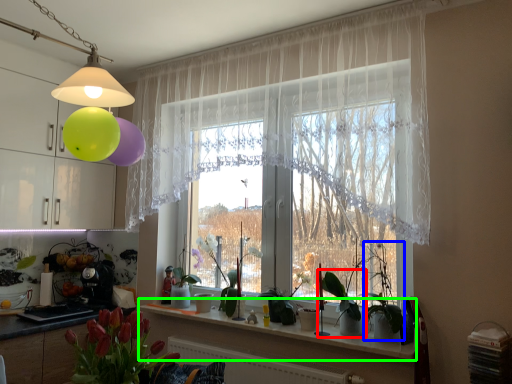
Question: Which object is the closest to the plant (highlighted by a red box)? Choose among these: plant (highlighted by a blue box) or window sill (highlighted by a green box).

Choices:
 (A) plant
 (B) window sill

Answer: (A)